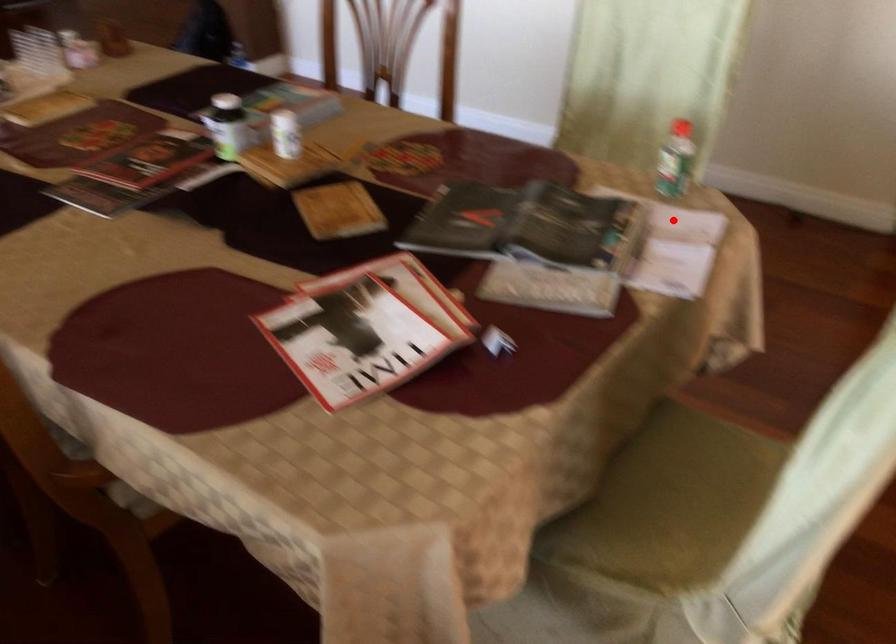
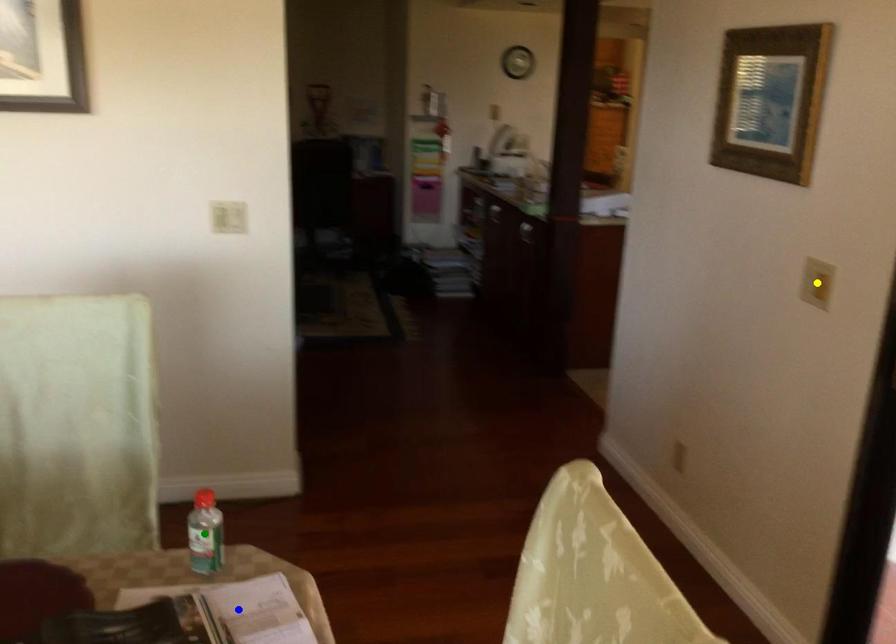
Question: I am providing you with two images of the same scene from different viewpoints. A red point is marked on the first image. You are given multiple points on the second image. In image 2, which mark is for the same physical point as the one in image 1?

Choices:
 (A) blue point
 (B) green point
 (C) yellow point

Answer: (A)